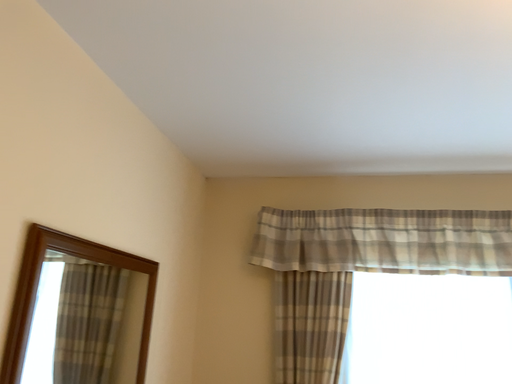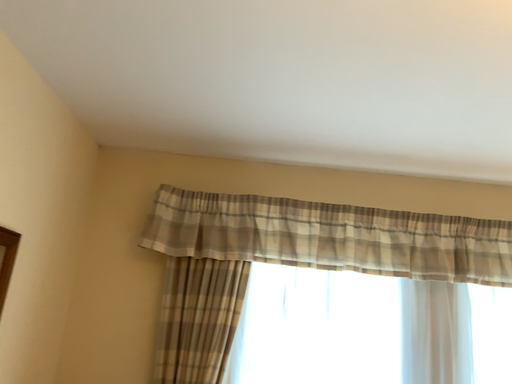
Question: How did the camera likely rotate when shooting the video?

Choices:
 (A) rotated right
 (B) rotated left

Answer: (A)